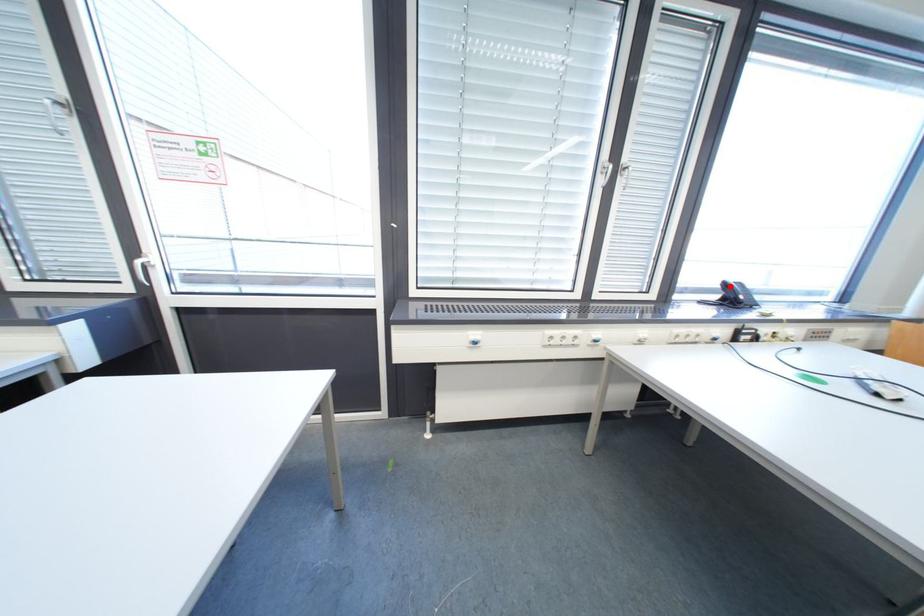
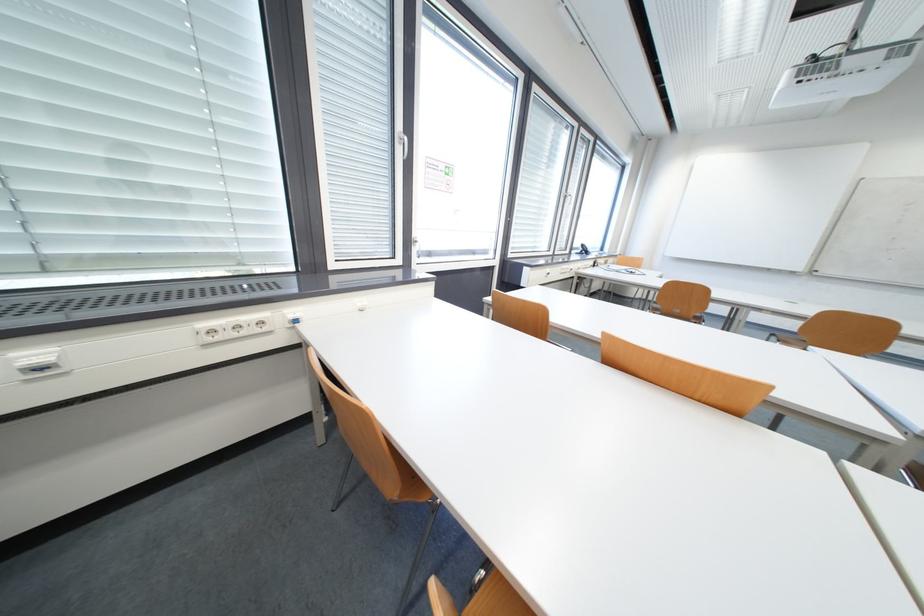
Question: I am providing you with two images of the same scene from different viewpoints. Given a red point in image1, look at the same physical point in image2. Is it:

Choices:
 (A) Closer to the viewpoint
 (B) Farther from the viewpoint

Answer: (A)